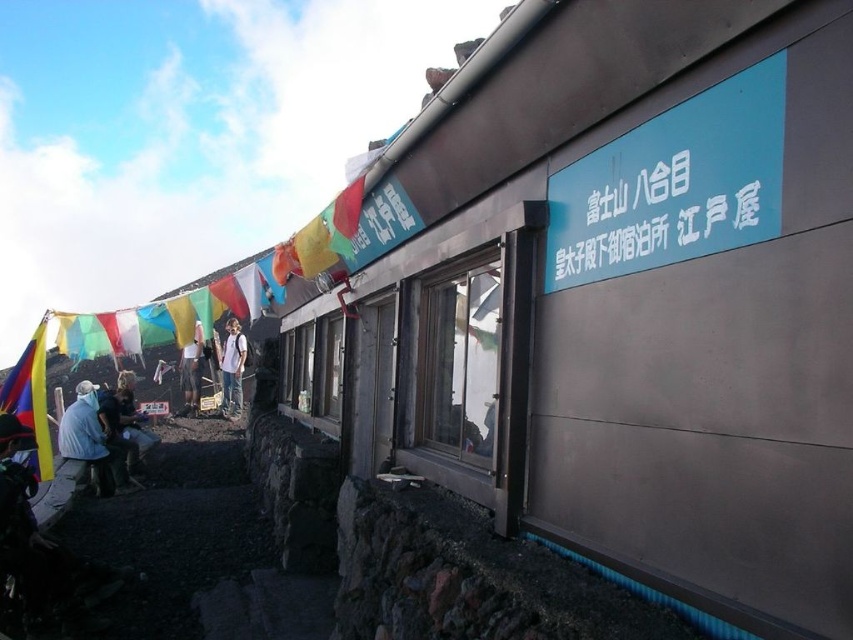
Question: Observing the image, what is the correct spatial positioning of white cotton shirt at center in reference to white plastic sign at upper center?

Choices:
 (A) below
 (B) above

Answer: (B)

Question: Considering the real-world distances, which object is farthest from the light blue fabric at center?

Choices:
 (A) multicolored fabric flag at left
 (B) white cotton shirt at center

Answer: (A)

Question: Is white cotton shirt at center smaller than light blue fabric at center?

Choices:
 (A) yes
 (B) no

Answer: (A)

Question: Can you confirm if white cotton shirt at center is positioned to the right of white plastic sign at upper center?

Choices:
 (A) yes
 (B) no

Answer: (A)

Question: Which object appears farthest from the camera in this image?

Choices:
 (A) light blue fabric at center
 (B) white cotton shirt at center

Answer: (B)

Question: Estimate the real-world distances between objects in this image. Which object is farther from the light blue fabric at center?

Choices:
 (A) white plastic sign at upper center
 (B) denim jacket at lower left

Answer: (B)